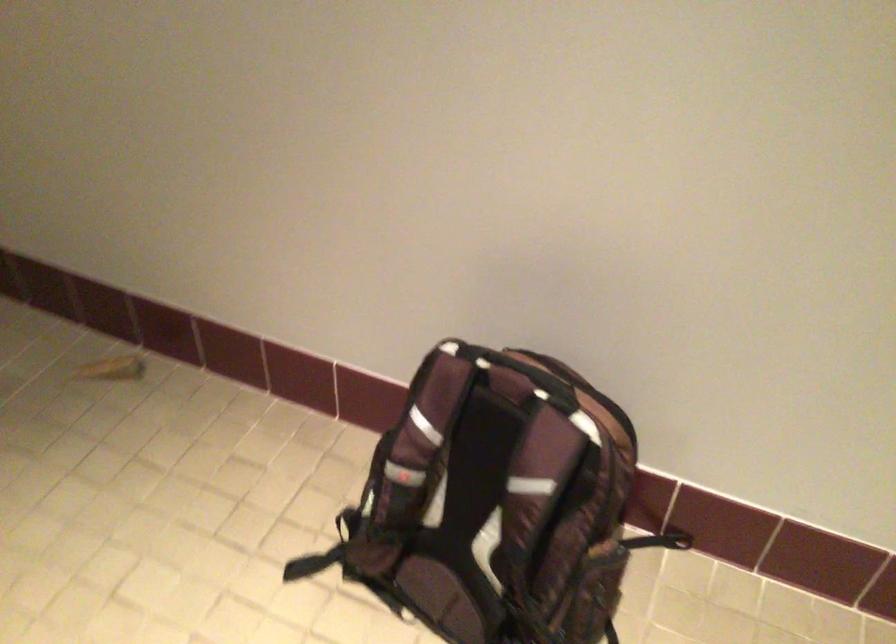
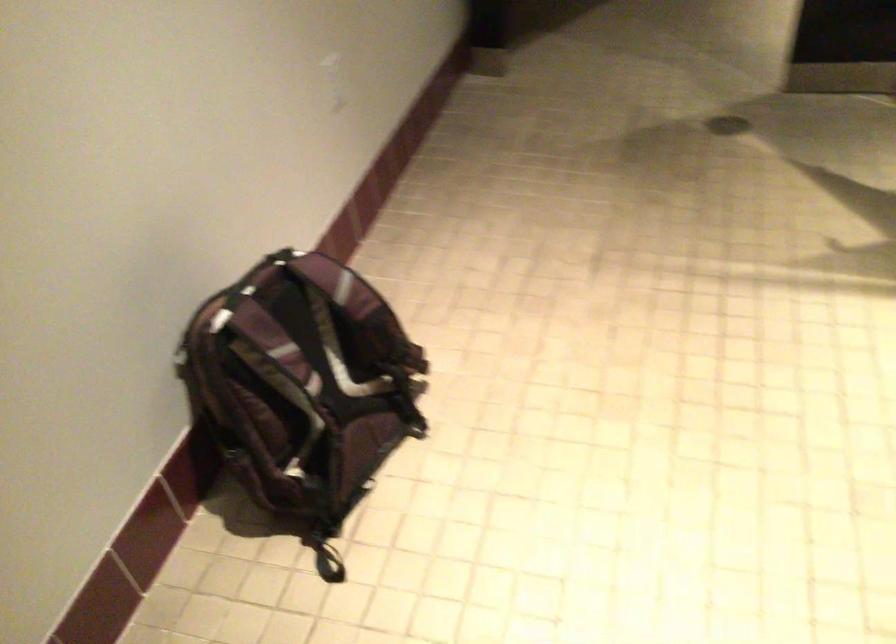
Locate, in the second image, the point that corresponds to the point at 312,561 in the first image.

(328, 567)